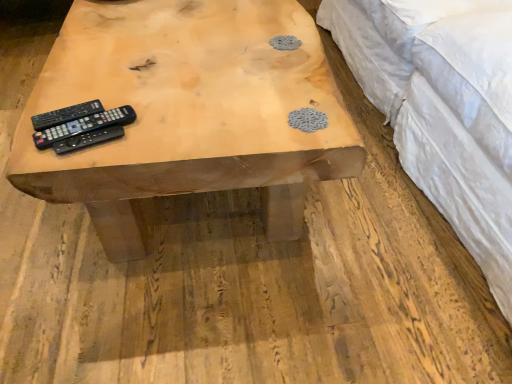
Question: Can you confirm if white quilted fabric at upper right is smaller than natural wood table at center?

Choices:
 (A) no
 (B) yes

Answer: (A)

Question: Is the depth of white quilted fabric at upper right greater than that of natural wood table at center?

Choices:
 (A) yes
 (B) no

Answer: (B)

Question: Is natural wood table at center at the back of white quilted fabric at upper right?

Choices:
 (A) yes
 (B) no

Answer: (B)

Question: From the image's perspective, is white quilted fabric at upper right beneath natural wood table at center?

Choices:
 (A) yes
 (B) no

Answer: (B)

Question: Is white quilted fabric at upper right directly adjacent to natural wood table at center?

Choices:
 (A) no
 (B) yes

Answer: (A)

Question: Considering the positions of point coord(230,148) and point coord(109,122), is point coord(230,148) closer or farther from the camera than point coord(109,122)?

Choices:
 (A) farther
 (B) closer

Answer: (B)

Question: From the image's perspective, is natural wood table at center positioned above or below black plastic remote at left, which ranks as the 2th remote control in front-to-back order?

Choices:
 (A) below
 (B) above

Answer: (B)

Question: Relative to black plastic remote at left, which ranks as the 2th remote control in back-to-front order, is natural wood table at center in front or behind?

Choices:
 (A) behind
 (B) front

Answer: (B)

Question: In terms of width, does natural wood table at center look wider or thinner when compared to black plastic remote at left, which ranks as the 2th remote control in front-to-back order?

Choices:
 (A) wide
 (B) thin

Answer: (A)

Question: Is natural wood table at center taller or shorter than black matte remote control at center, which appears as the first remote control when viewed from the front?

Choices:
 (A) short
 (B) tall

Answer: (B)

Question: Is natural wood table at center situated inside black matte remote control at center, which is the third remote control from back to front, or outside?

Choices:
 (A) outside
 (B) inside

Answer: (A)

Question: Visually, is natural wood table at center positioned to the left or to the right of black matte remote control at center, which is the third remote control from back to front?

Choices:
 (A) right
 (B) left

Answer: (A)

Question: Is point (257, 122) closer or farther from the camera than point (104, 135)?

Choices:
 (A) farther
 (B) closer

Answer: (A)

Question: From the image's perspective, is black matte remote control at left, which is the first remote control from back to front, located above or below black matte remote control at center, which is the third remote control from back to front?

Choices:
 (A) below
 (B) above

Answer: (B)

Question: Considering the positions of black matte remote control at left, which is the first remote control from back to front, and black matte remote control at center, which appears as the first remote control when viewed from the front, in the image, is black matte remote control at left, which is the first remote control from back to front, wider or thinner than black matte remote control at center, which appears as the first remote control when viewed from the front,?

Choices:
 (A) wide
 (B) thin

Answer: (B)